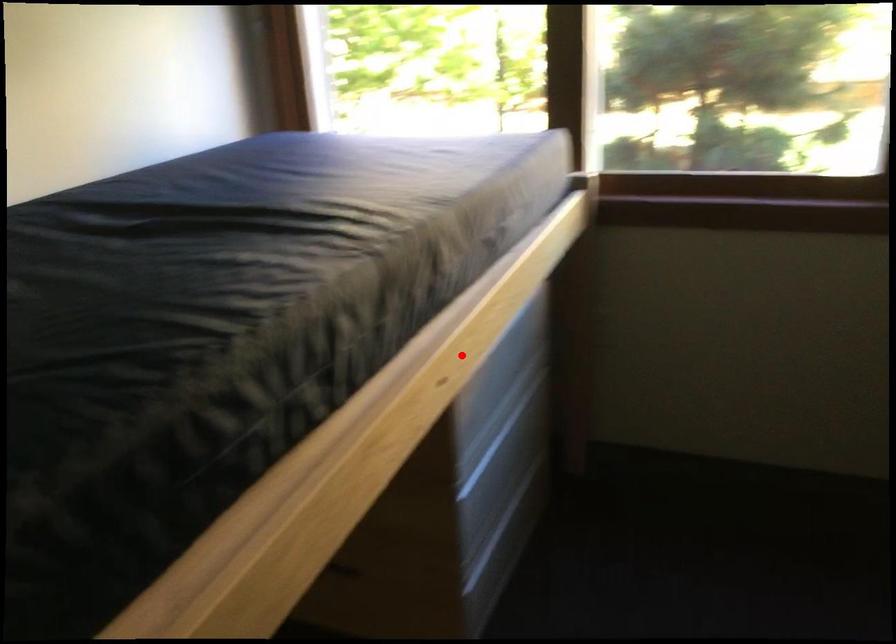
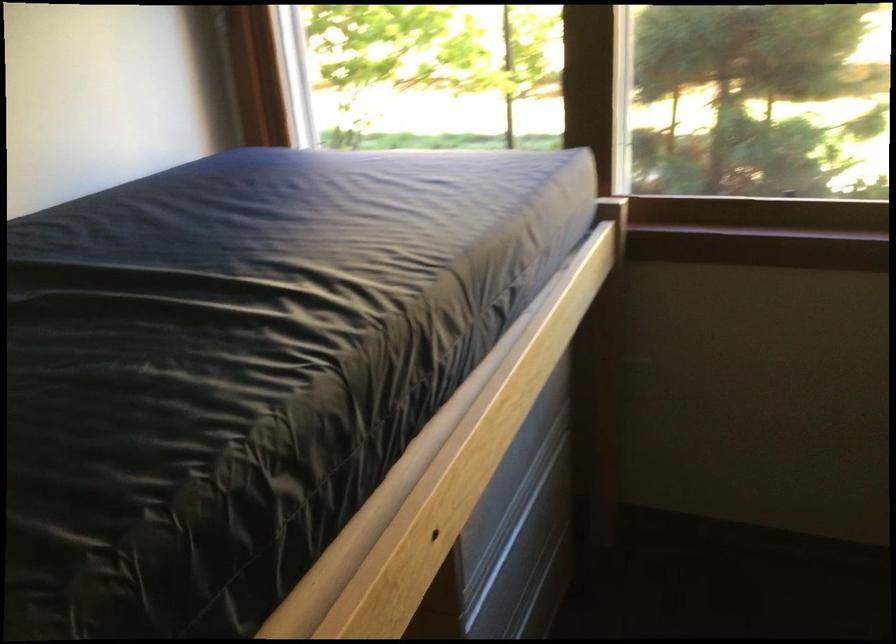
In the second image, find the point that corresponds to the highlighted location in the first image.

(467, 478)